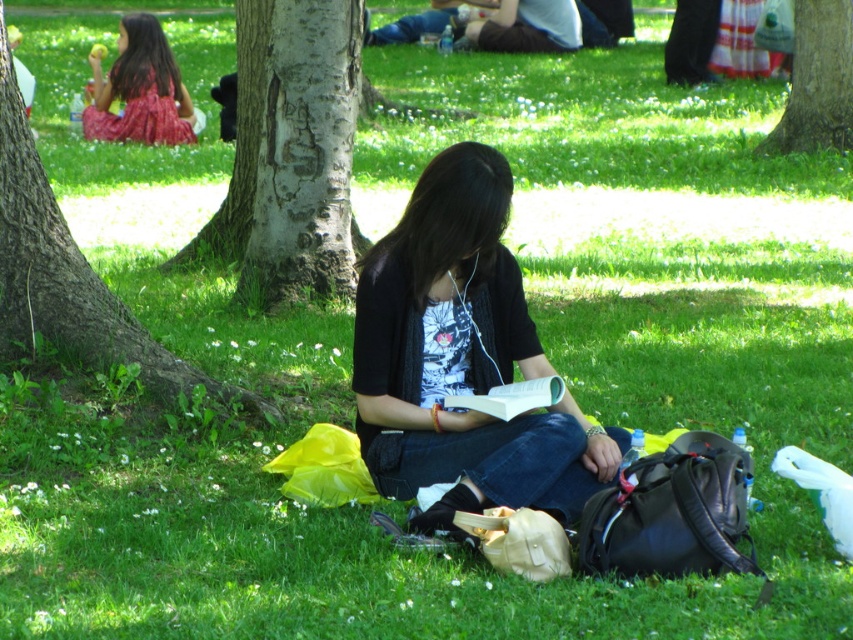
Is matte black shirt at center closer to camera compared to smooth gray bark at center?

That is True.

Describe the element at coordinates (461, 358) in the screenshot. I see `matte black shirt at center` at that location.

Where is `matte black shirt at center`? The height and width of the screenshot is (640, 853). matte black shirt at center is located at coordinates (461, 358).

Is point (373, 372) in front of point (503, 401)?

That is False.

Measure the distance between matte black shirt at center and white paper book at center.

matte black shirt at center is 7.41 inches from white paper book at center.

Does point (502, 225) lie behind point (494, 387)?

No, (502, 225) is in front of (494, 387).

This screenshot has height=640, width=853. I want to click on matte black shirt at center, so click(461, 358).

Is smooth gray bark at lower left shorter than smooth bark tree at upper right?

In fact, smooth gray bark at lower left may be taller than smooth bark tree at upper right.

Does smooth gray bark at lower left have a greater height compared to smooth bark tree at upper right?

Yes.

Where is `smooth gray bark at lower left`? The image size is (853, 640). smooth gray bark at lower left is located at coordinates (70, 276).